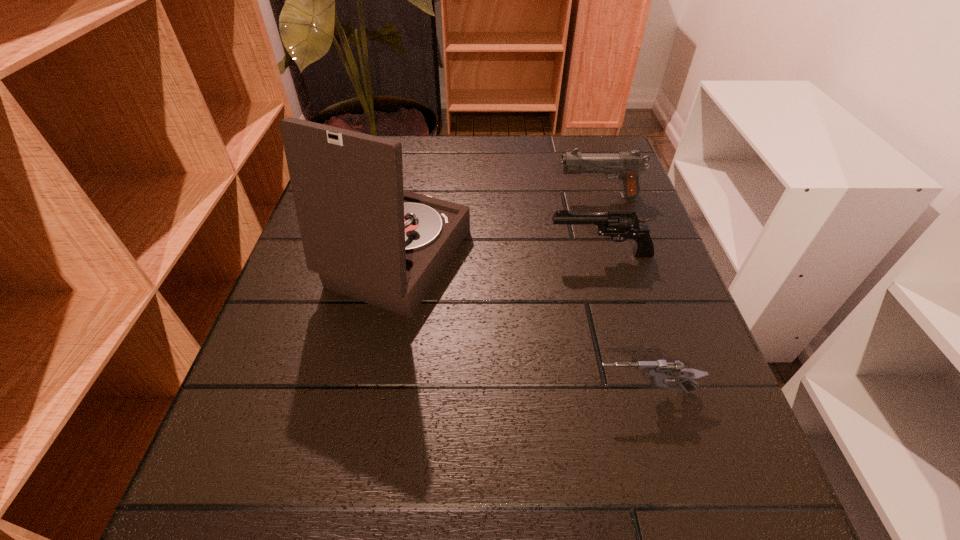
I want to click on free spot located at the end of the barrel of the second farthest gun, so click(457, 254).

Where is `free space located 0.150m at the end of the barrel of the second farthest gun`? This screenshot has width=960, height=540. free space located 0.150m at the end of the barrel of the second farthest gun is located at coordinates (471, 254).

Find the location of `free spot located 0.300m at the end of the barrel of the second farthest gun`. free spot located 0.300m at the end of the barrel of the second farthest gun is located at coordinates (396, 254).

Identify the location of free region located at the barrel of the shortest gun. (365, 392).

Identify the location of vacant region located 0.060m at the barrel of the shortest gun. (552, 392).

Image resolution: width=960 pixels, height=540 pixels. I want to click on free point located at the barrel of the shortest gun, so click(x=372, y=392).

Identify the location of object that is positioned at the left edge. (367, 238).

This screenshot has width=960, height=540. In the image, there is a desktop. What are the coordinates of `free space at the far edge` in the screenshot? It's located at (461, 170).

Locate an element on the screen. Image resolution: width=960 pixels, height=540 pixels. vacant region at the left edge of the desktop is located at coordinates (338, 322).

You are a GUI agent. You are given a task and a screenshot of the screen. Output one action in this format:
    pyautogui.click(x=<x>, y=<y>)
    Task: Click on the free space at the right edge
    This screenshot has height=540, width=960.
    Given the screenshot: What is the action you would take?
    pyautogui.click(x=664, y=252)